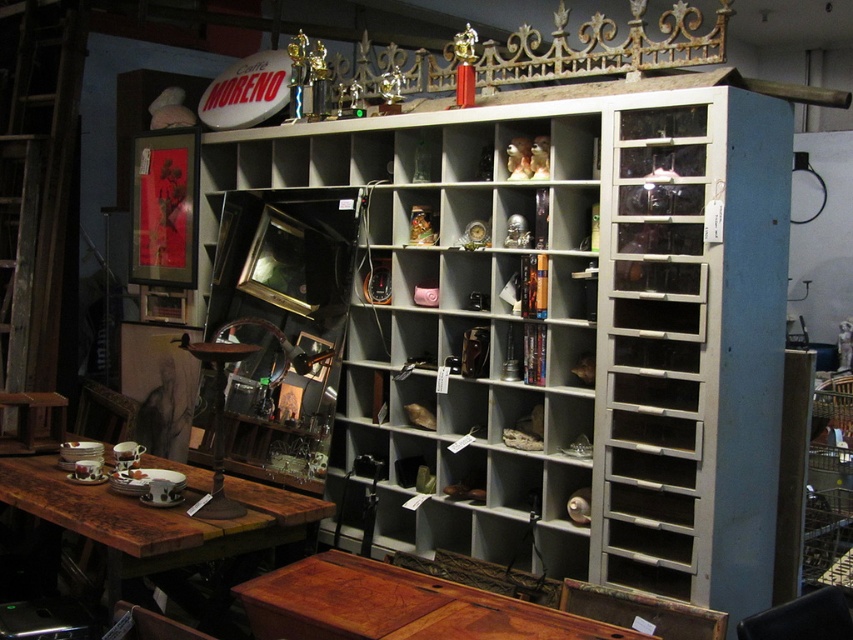
Question: Is white painted wood bookshelf at center to the right of wooden polished table at lower center from the viewer's perspective?

Choices:
 (A) no
 (B) yes

Answer: (B)

Question: Which point is closer to the camera?

Choices:
 (A) (401, 410)
 (B) (338, 627)
 (C) (247, 493)

Answer: (B)

Question: Does wooden polished table at lower center appear under rustic wood table at lower left?

Choices:
 (A) yes
 (B) no

Answer: (A)

Question: Is the position of wooden polished table at lower center less distant than that of rustic wood table at lower left?

Choices:
 (A) yes
 (B) no

Answer: (A)

Question: Which object appears farthest from the camera in this image?

Choices:
 (A) wooden polished table at lower center
 (B) rustic wood table at lower left
 (C) white painted wood bookshelf at center

Answer: (C)

Question: Among these objects, which one is farthest from the camera?

Choices:
 (A) rustic wood table at lower left
 (B) wooden polished table at lower center

Answer: (A)